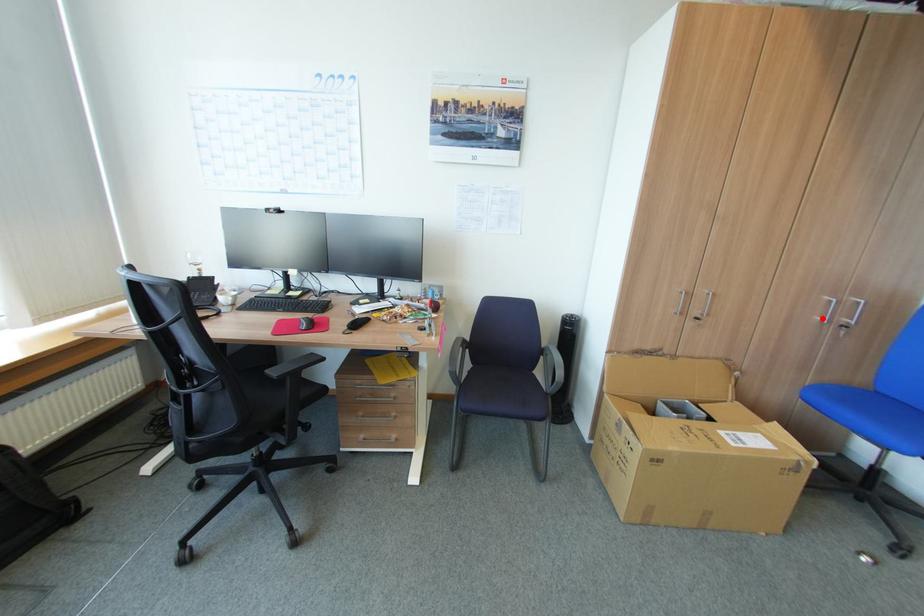
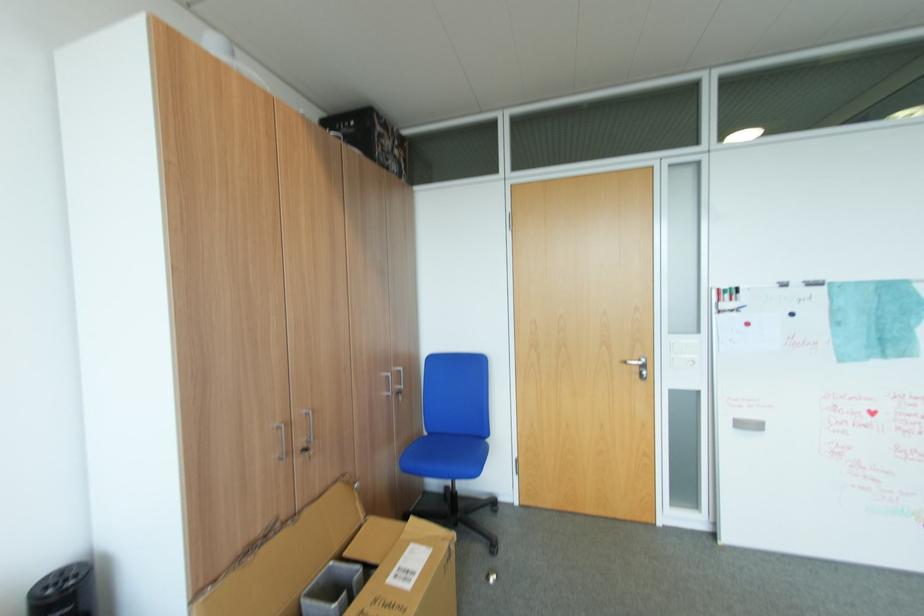
In the second image, find the point that corresponds to the highlighted location in the first image.

(390, 394)